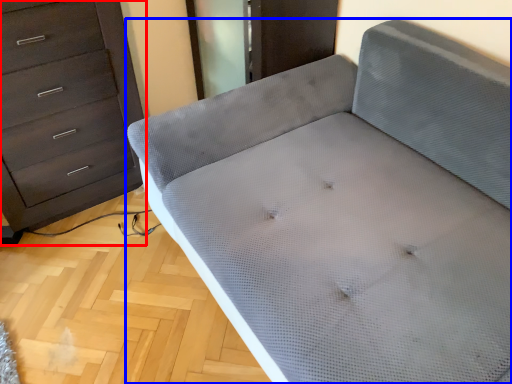
Question: Which object appears farthest to the camera in this image, chest of drawers (highlighted by a red box) or furniture (highlighted by a blue box)?

Choices:
 (A) chest of drawers
 (B) furniture

Answer: (A)